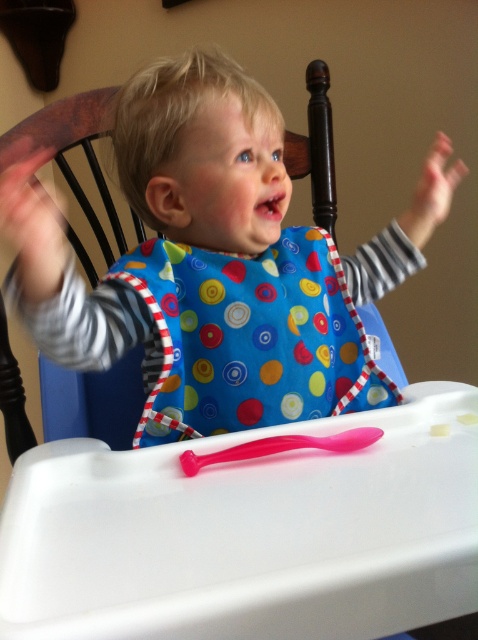
Question: Does blue fabric bib at center appear over pink rubber hand at upper right?

Choices:
 (A) yes
 (B) no

Answer: (B)

Question: Can you confirm if blue fabric bib at center is positioned to the left of pink rubber hand at upper right?

Choices:
 (A) no
 (B) yes

Answer: (B)

Question: Which point is farther to the camera?

Choices:
 (A) blue fabric bib at center
 (B) pink rubber hand at upper right

Answer: (B)

Question: Which point is closer to the camera?

Choices:
 (A) blue fabric bib at center
 (B) pink rubber hand at upper right

Answer: (A)

Question: In this image, where is blue fabric bib at center located relative to pink rubber hand at upper right?

Choices:
 (A) above
 (B) below

Answer: (B)

Question: Which object appears closest to the camera in this image?

Choices:
 (A) blue fabric bib at center
 (B) pink rubber hand at upper right

Answer: (A)